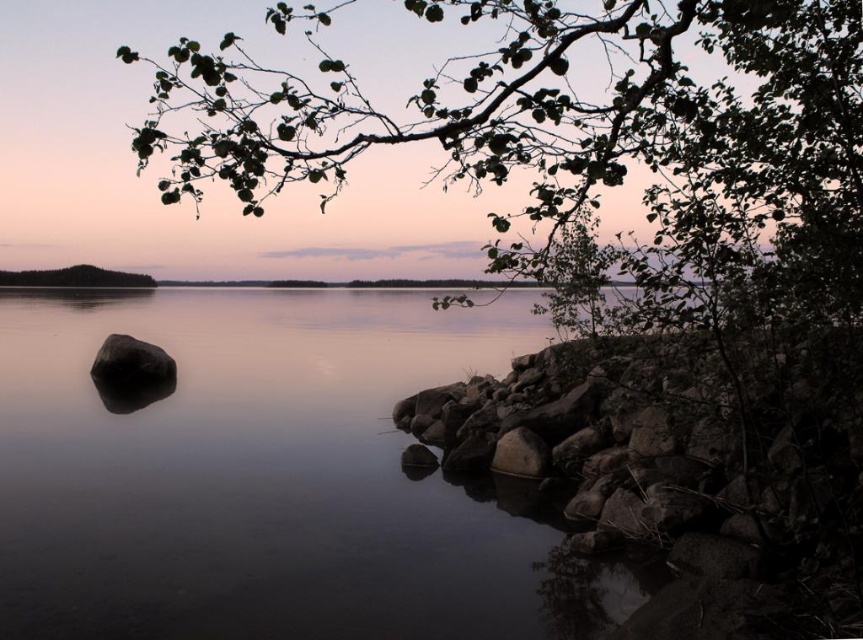
Who is more distant from viewer, (156, 362) or (68, 282)?

The point (68, 282) is behind.

Does black smooth rock at left have a smaller size compared to green leafy tree at left?

Yes.

Where is `black smooth rock at left`? Image resolution: width=863 pixels, height=640 pixels. black smooth rock at left is located at coordinates (131, 364).

Based on the photo, does smooth water at center appear on the left side of green leafy branch at upper center?

Indeed, smooth water at center is positioned on the left side of green leafy branch at upper center.

Between point (154, 499) and point (606, 160), which one is positioned in front?

Point (606, 160) is more forward.

Is point (124, 429) positioned after point (753, 40)?

Yes, it is behind point (753, 40).

Where is `smooth water at center`? This screenshot has height=640, width=863. smooth water at center is located at coordinates (269, 477).

Between smooth water at center and green leafy tree at left, which one is positioned higher?

Positioned higher is green leafy tree at left.

Is smooth water at center shorter than green leafy tree at left?

No, smooth water at center is not shorter than green leafy tree at left.

Between point (203, 554) and point (127, 284), which one is positioned in front?

Point (203, 554)

Identify the location of smooth water at center. The width and height of the screenshot is (863, 640). (269, 477).